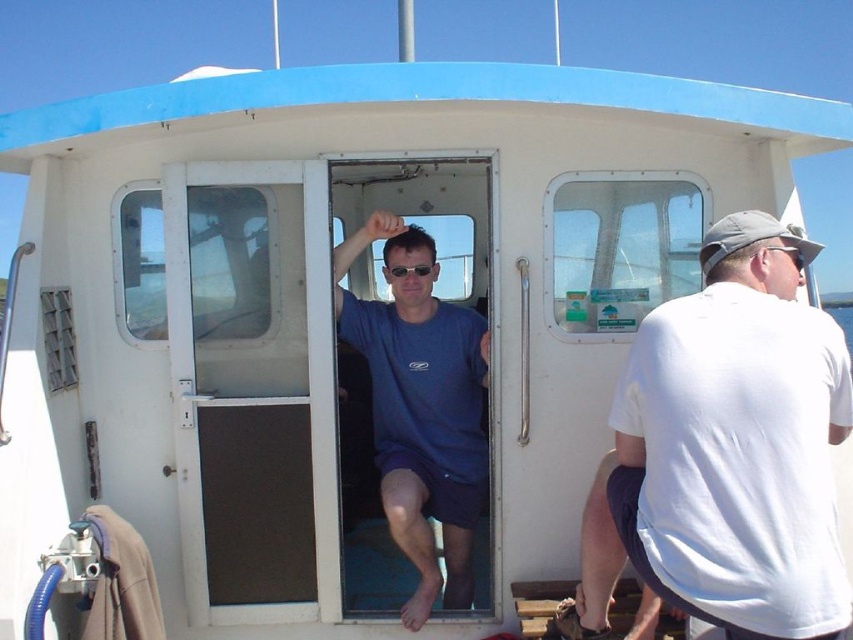
Is sunglasses at center above clear plastic goggles at upper right?

Actually, sunglasses at center is below clear plastic goggles at upper right.

Does point (396, 276) come behind point (801, 268)?

Yes, it is behind point (801, 268).

What are the coordinates of `sunglasses at center` in the screenshot? It's located at (410, 269).

Consider the image. Is blue matte shirt at center smaller than clear plastic goggles at upper right?

Incorrect, blue matte shirt at center is not smaller in size than clear plastic goggles at upper right.

Which is behind, point (439, 477) or point (790, 252)?

Positioned behind is point (439, 477).

Where is `blue matte shirt at center`? blue matte shirt at center is located at coordinates (421, 410).

Where is `white matte shirt at right`? Image resolution: width=853 pixels, height=640 pixels. white matte shirt at right is located at coordinates (735, 444).

Does white matte shirt at right lie behind clear plastic goggles at upper right?

No, white matte shirt at right is closer to the viewer.

The height and width of the screenshot is (640, 853). I want to click on white matte shirt at right, so click(735, 444).